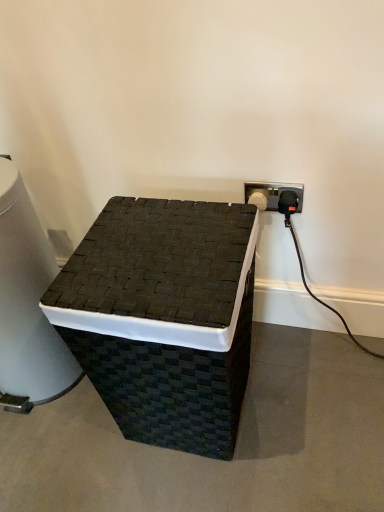
Find the location of a particular element. The height and width of the screenshot is (512, 384). black woven basket at center is located at coordinates (162, 318).

What do you see at coordinates (162, 318) in the screenshot?
I see `black woven basket at center` at bounding box center [162, 318].

Identify the location of black woven water cooler at left. This screenshot has width=384, height=512. (27, 305).

Measure the distance between point (22, 288) and camera.

The depth of point (22, 288) is 1.00 meters.

The image size is (384, 512). Describe the element at coordinates (27, 305) in the screenshot. I see `black woven water cooler at left` at that location.

The width and height of the screenshot is (384, 512). Find the location of `black woven basket at center`. black woven basket at center is located at coordinates (162, 318).

Is black woven basket at center to the right of black woven water cooler at left from the viewer's perspective?

Yes, black woven basket at center is to the right of black woven water cooler at left.

Between black woven basket at center and black woven water cooler at left, which one is positioned in front?

→ black woven basket at center is closer to the camera.

Which is behind, point (95, 228) or point (19, 224)?

The point (19, 224) is farther from the camera.

From the image's perspective, relative to black woven water cooler at left, is black woven basket at center above or below?

black woven basket at center is below black woven water cooler at left.

From a real-world perspective, is black woven basket at center on top of black woven water cooler at left?

No.

Considering the sizes of objects black woven basket at center and black woven water cooler at left in the image provided, who is thinner, black woven basket at center or black woven water cooler at left?

black woven water cooler at left.

Does black woven basket at center have a lesser height compared to black woven water cooler at left?

Yes.

Considering the sizes of objects black woven basket at center and black woven water cooler at left in the image provided, who is bigger, black woven basket at center or black woven water cooler at left?

With larger size is black woven basket at center.

Is black woven water cooler at left a part of black woven basket at center?

No, black woven basket at center does not contain black woven water cooler at left.

Is the surface of black woven basket at center in direct contact with black woven water cooler at left?

There is a gap between black woven basket at center and black woven water cooler at left.

Based on the photo, is black woven basket at center positioned with its back to black woven water cooler at left?

No, black woven basket at center's orientation is not away from black woven water cooler at left.

How different are the orientations of black woven basket at center and black woven water cooler at left in degrees?

The angular difference between black woven basket at center and black woven water cooler at left is 0.000471 degrees.

Find the location of a particular element. Image resolution: width=384 pixels, height=512 pixels. furniture in front of the black woven water cooler at left is located at coordinates (162, 318).

Which object is positioned more to the right, black woven water cooler at left or black woven basket at center?

black woven basket at center is more to the right.

Considering the relative positions of black woven water cooler at left and black woven basket at center in the image provided, is black woven water cooler at left in front of black woven basket at center?

No, black woven water cooler at left is further to the viewer.

Which is closer, (7, 234) or (110, 302)?

Point (7, 234) is farther from the camera than point (110, 302).

From the image's perspective, relative to black woven basket at center, is black woven water cooler at left above or below?

From the image's perspective, black woven water cooler at left appears above black woven basket at center.

From a real-world perspective, is black woven water cooler at left physically below black woven basket at center?

No, from a real-world perspective, black woven water cooler at left is not beneath black woven basket at center.

Between black woven water cooler at left and black woven basket at center, which one has smaller width?

black woven water cooler at left is thinner.

Is black woven water cooler at left taller or shorter than black woven basket at center?

black woven water cooler at left is taller than black woven basket at center.

Considering the sizes of objects black woven water cooler at left and black woven basket at center in the image provided, who is smaller, black woven water cooler at left or black woven basket at center?

black woven water cooler at left is smaller.

Is black woven water cooler at left inside or outside of black woven basket at center?

black woven water cooler at left is located beyond the bounds of black woven basket at center.

Can you see black woven water cooler at left touching black woven basket at center?

No, black woven water cooler at left is not next to black woven basket at center.

Does black woven water cooler at left turn towards black woven basket at center?

No, black woven water cooler at left is not turned towards black woven basket at center.

How different are the orientations of black woven water cooler at left and black woven basket at center in degrees?

0.000471 degrees.

Identify the location of water cooler behind the black woven basket at center. The height and width of the screenshot is (512, 384). (27, 305).

Identify the location of furniture in front of the black woven water cooler at left. The width and height of the screenshot is (384, 512). (162, 318).

Locate an element on the screen. Image resolution: width=384 pixels, height=512 pixels. furniture beneath the black woven water cooler at left (from a real-world perspective) is located at coordinates (162, 318).